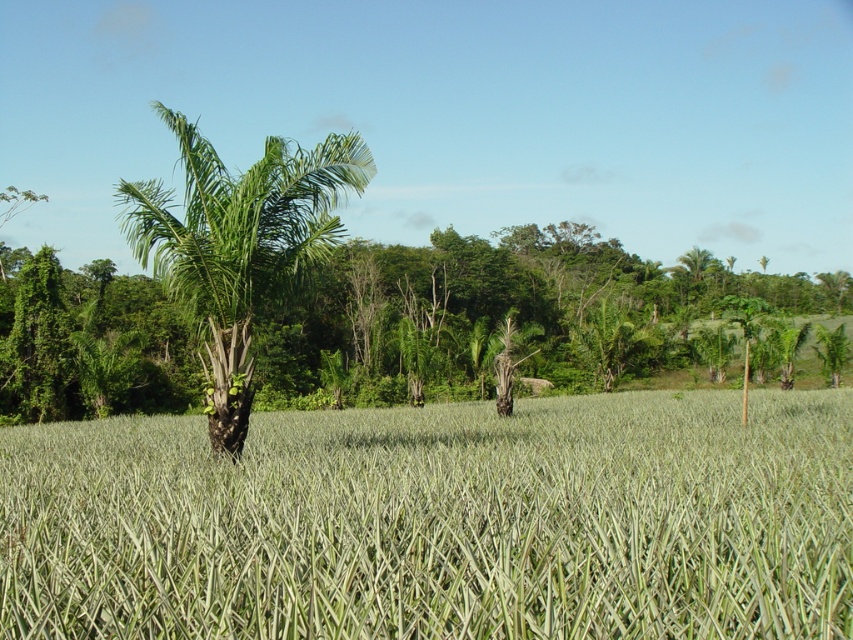
You are a farmer checking the growth of crops in the field. You notice the green grassy wheat field at center and the green leafy palm tree at center. Which one has a narrower width?

The green grassy wheat field at center is thinner than the green leafy palm tree at center, so the green grassy wheat field at center has a narrower width.

You are standing at the camera position looking at the agricultural field. There is a specific point marked at coordinates point (x=689, y=598). Can you estimate how far this point is from your current position?

The point (x=689, y=598) is 3.28 meters away from the camera, so the distance is approximately 3.28 meters.

You are standing at the point marked by the coordinates point (x=438, y=522) in the agricultural field. What type of vegetation are you currently standing on?

The point (x=438, y=522) is labeled as green grassy wheat field at center, so you are standing on green grassy wheat field at center.